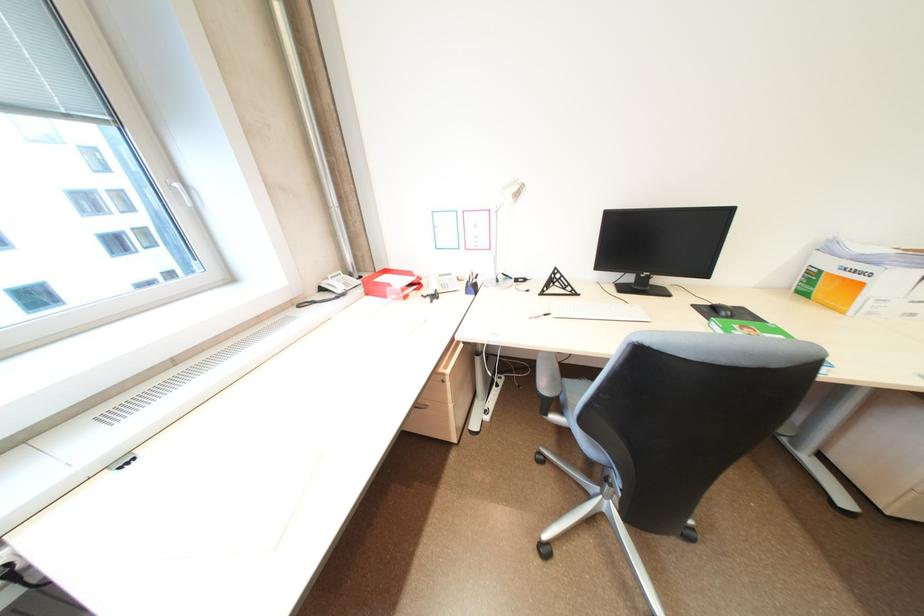
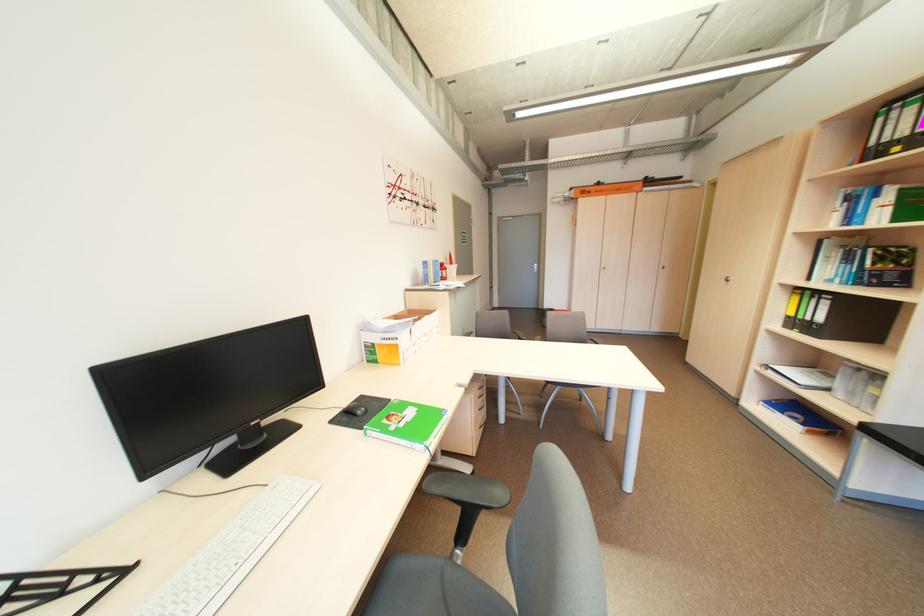
Find the pixel in the second image that matches pixel 869 286 in the first image.

(406, 347)